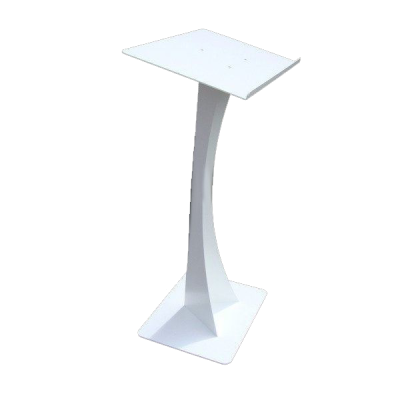
Locate an element on the screen. This screenshot has height=400, width=400. podium top is located at coordinates (208, 61).